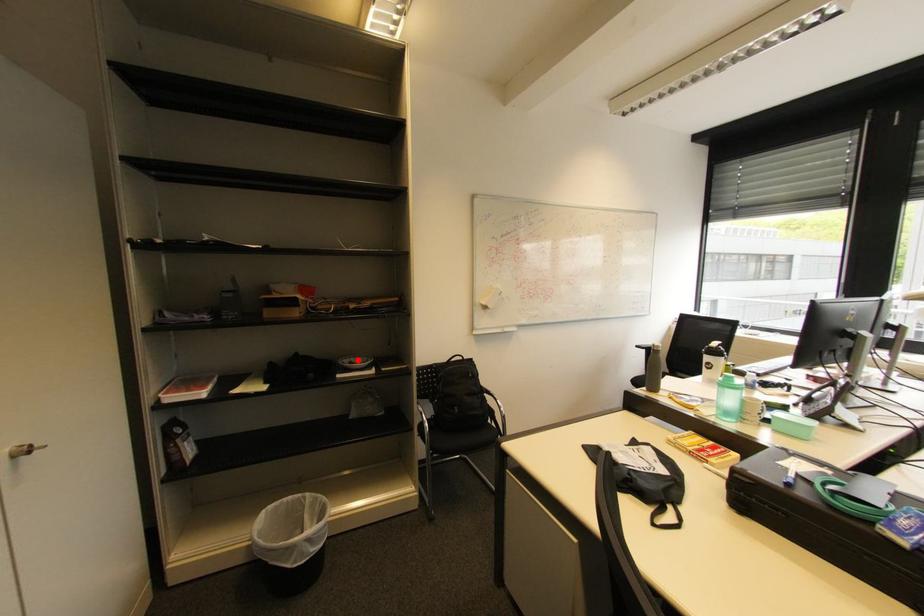
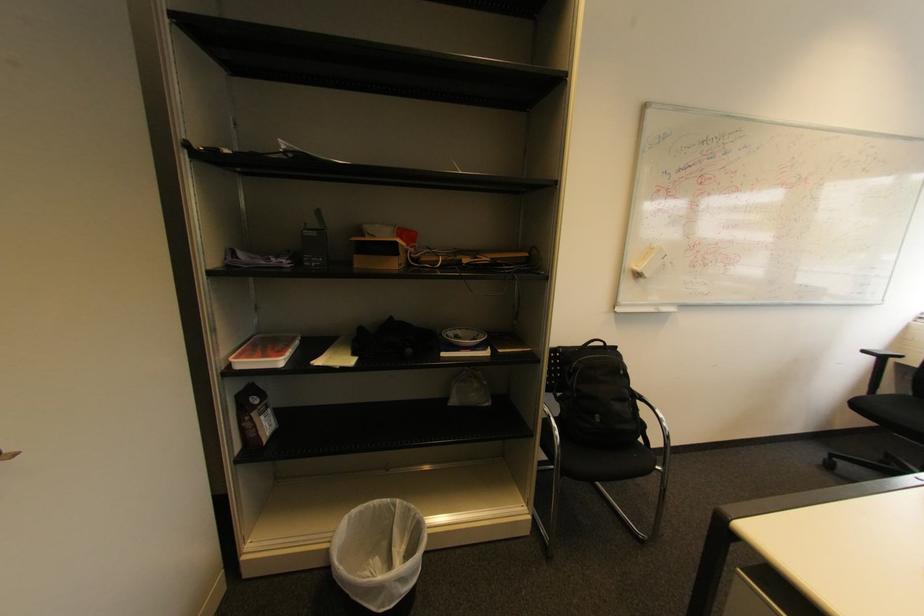
Where in the second image is the point corresponding to the highlighted location from the first image?

(464, 333)